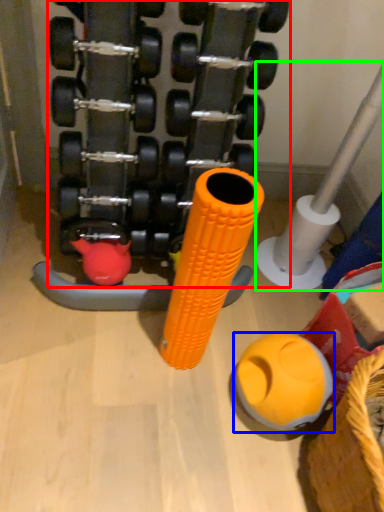
Question: Which is nearer to the dumbbell (highlighted by a red box)? toy (highlighted by a blue box) or pipe (highlighted by a green box).

Choices:
 (A) toy
 (B) pipe

Answer: (B)